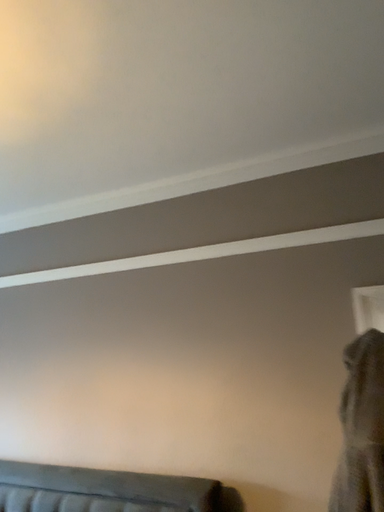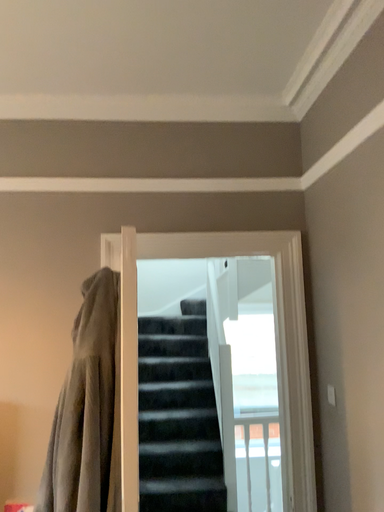
Question: Which way did the camera rotate in the video?

Choices:
 (A) rotated right
 (B) rotated left

Answer: (A)